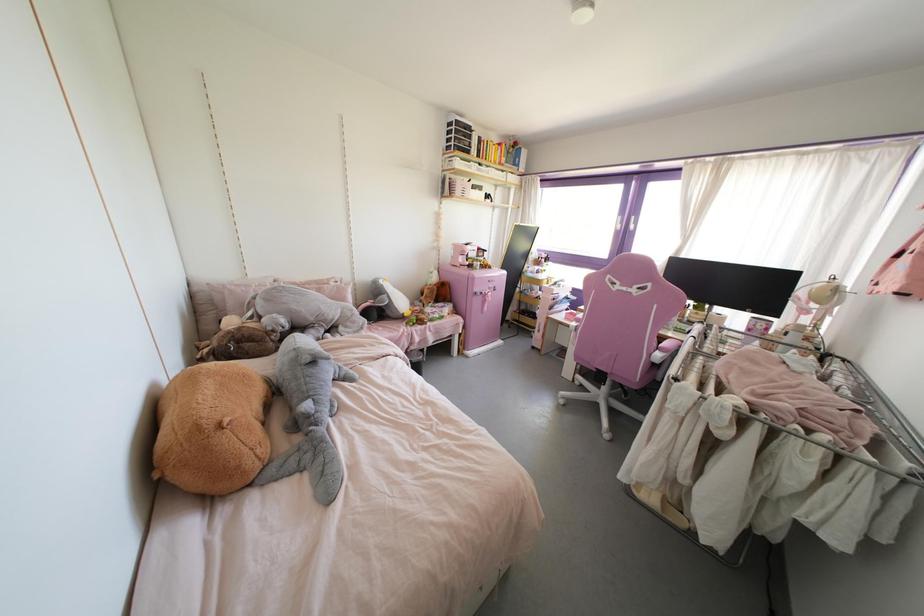
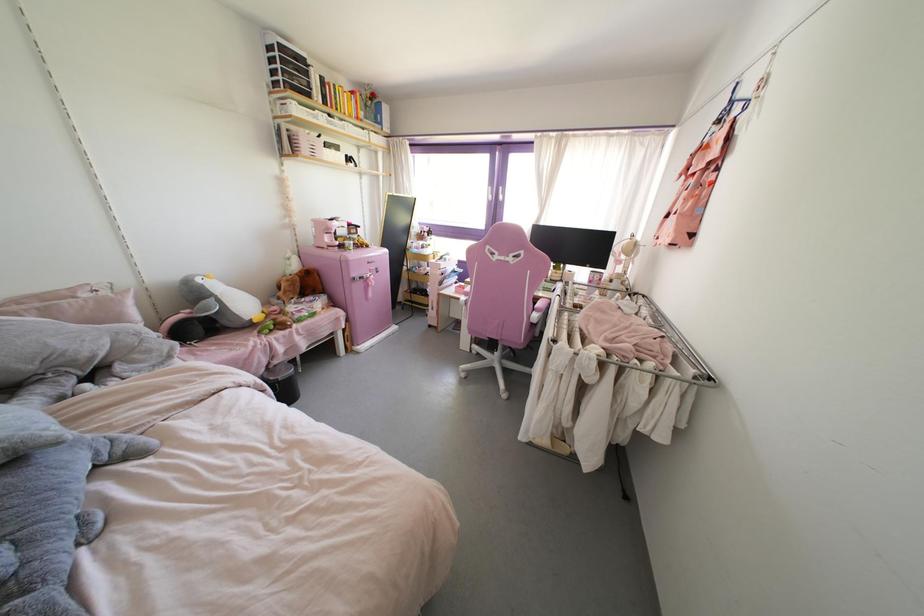
In the second image, find the point that corresponds to (332,283) in the first image.

(83, 294)